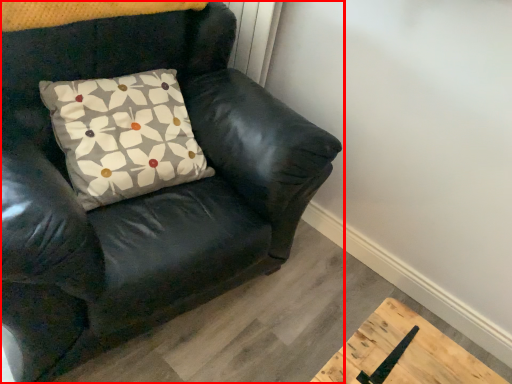
Question: In this image, where is chair (annotated by the red box) located relative to pillow?

Choices:
 (A) right
 (B) left

Answer: (B)